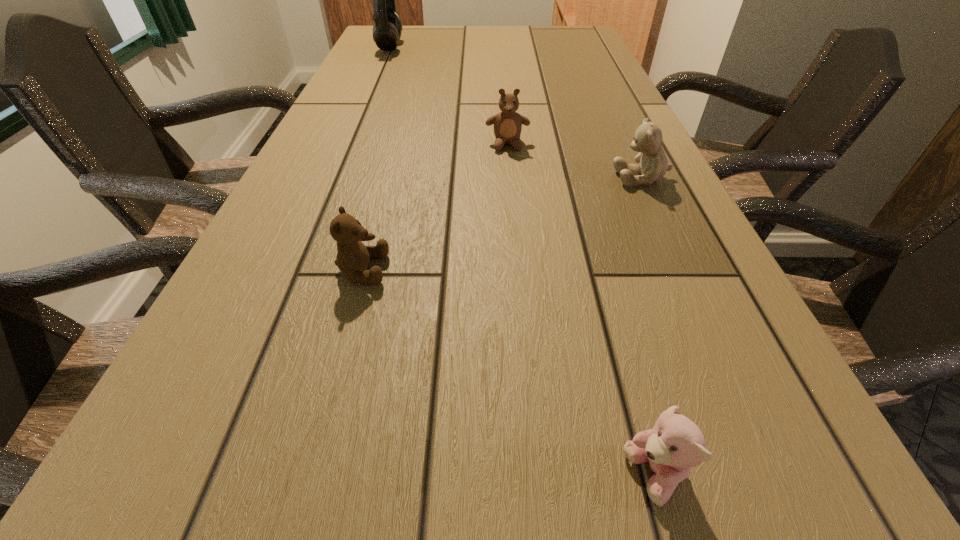
At what (x,y) coordinates should I click in order to perform the action: click on free space located on the earcups of the tallest object. Please return your answer as a coordinate pair (x, y). Looking at the image, I should click on (522, 47).

Locate an element on the screen. The width and height of the screenshot is (960, 540). free location located 0.130m on the front-facing side of the third object from right to left is located at coordinates (511, 187).

This screenshot has width=960, height=540. In order to click on free space located on the face of the rightmost object in this screenshot , I will do `click(539, 178)`.

Where is `vacant space situated 0.130m on the face of the rightmost object`? vacant space situated 0.130m on the face of the rightmost object is located at coordinates (549, 178).

Identify the location of vacant position located on the face of the rightmost object. This screenshot has height=540, width=960. (509, 178).

You are a GUI agent. You are given a task and a screenshot of the screen. Output one action in this format:
    pyautogui.click(x=<x>, y=<y>)
    Task: Click on the free point located 0.210m on the front-facing side of the fourth farthest object
    
    Given the screenshot: What is the action you would take?
    tap(520, 269)

Identify the location of vacant space located 0.150m at the face of the nearest teddy bear. (485, 476).

This screenshot has height=540, width=960. I want to click on vacant position located 0.360m at the face of the nearest teddy bear, so click(x=288, y=476).

Where is `free space located at the face of the nearest teddy bear`? free space located at the face of the nearest teddy bear is located at coordinates (363, 476).

The image size is (960, 540). I want to click on object present at the far edge, so click(x=387, y=29).